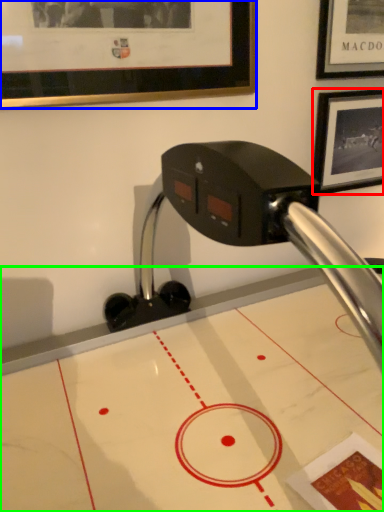
Question: Considering the real-world distances, which object is closest to picture frame (highlighted by a red box)? picture frame (highlighted by a blue box) or table (highlighted by a green box).

Choices:
 (A) picture frame
 (B) table

Answer: (A)